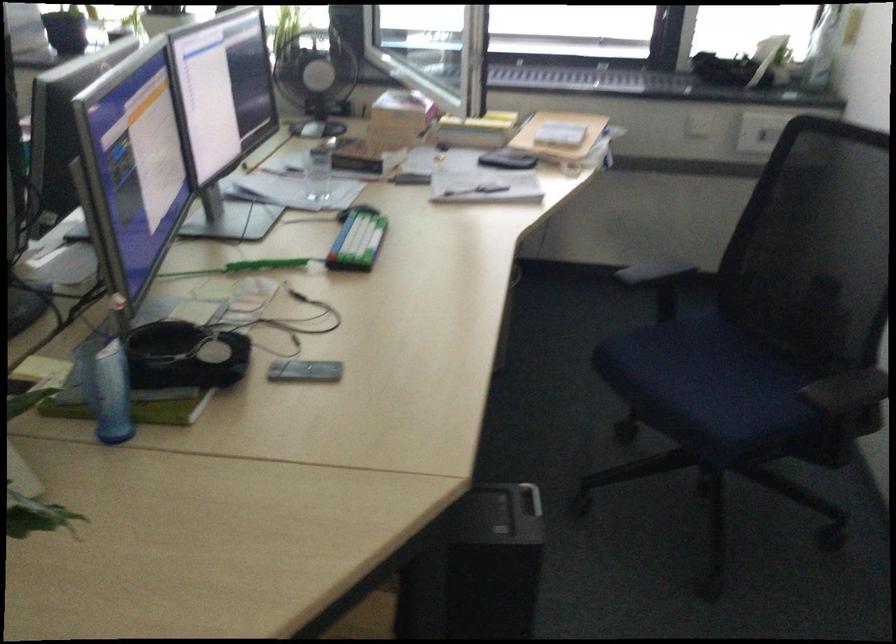
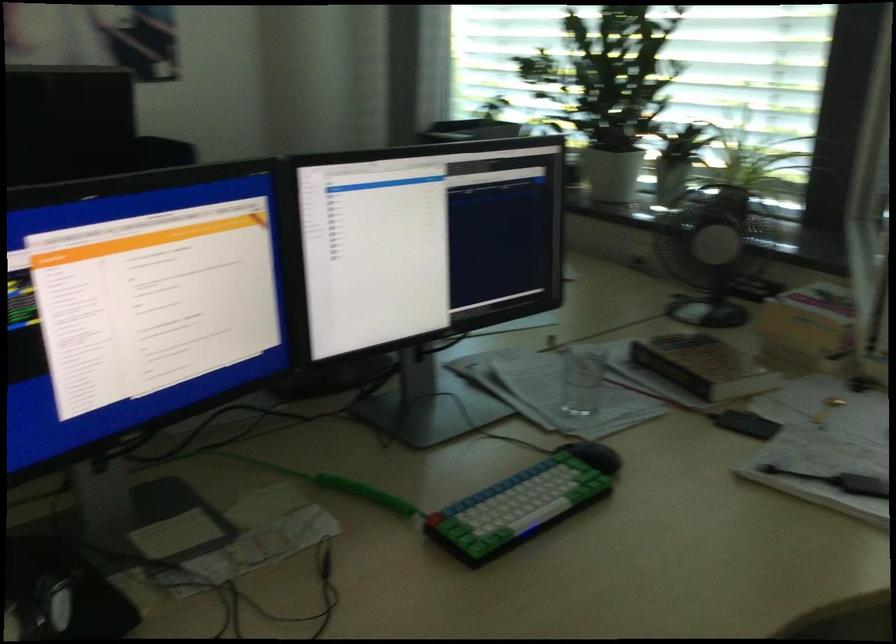
Where in the second image is the point corresponding to (x=375, y=155) from the first image?

(703, 366)